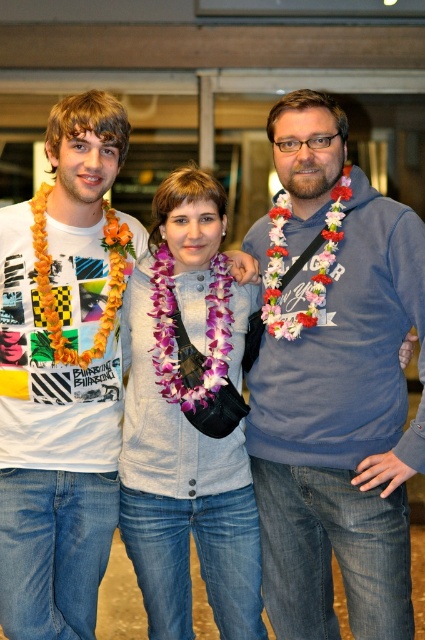
Question: In this image, where is blue fleece sweater at center located relative to matte white t-shirt at left?

Choices:
 (A) left
 (B) right

Answer: (B)

Question: Among these points, which one is nearest to the camera?

Choices:
 (A) (362, 465)
 (B) (31, 460)

Answer: (A)

Question: Does blue fleece sweater at center appear under matte white t-shirt at left?

Choices:
 (A) yes
 (B) no

Answer: (A)

Question: Does blue fleece sweater at center have a larger size compared to matte white t-shirt at left?

Choices:
 (A) yes
 (B) no

Answer: (A)

Question: Which object is farther from the camera taking this photo?

Choices:
 (A) matte white t-shirt at left
 (B) blue fleece sweater at center

Answer: (A)

Question: Among these points, which one is nearest to the camera?

Choices:
 (A) (42, 557)
 (B) (280, 410)

Answer: (A)